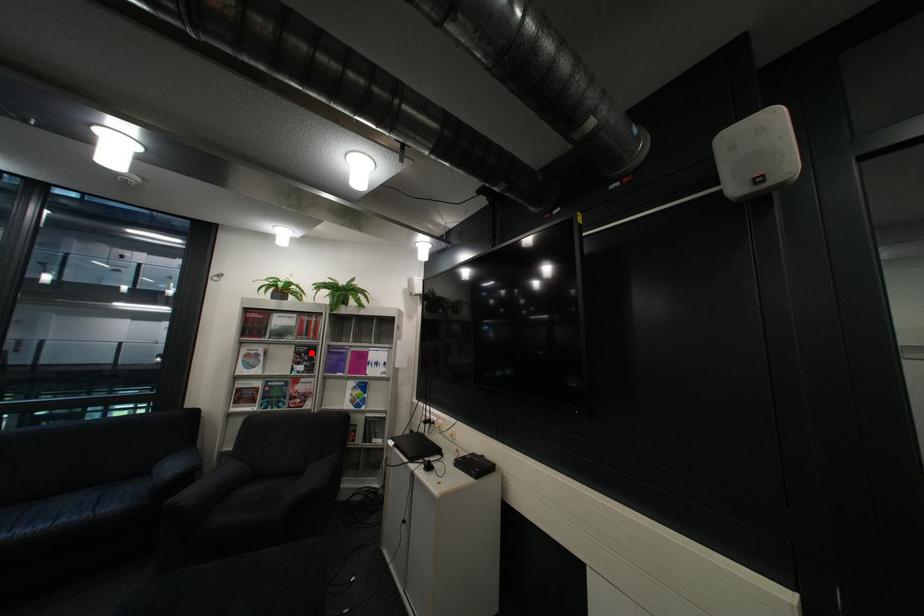
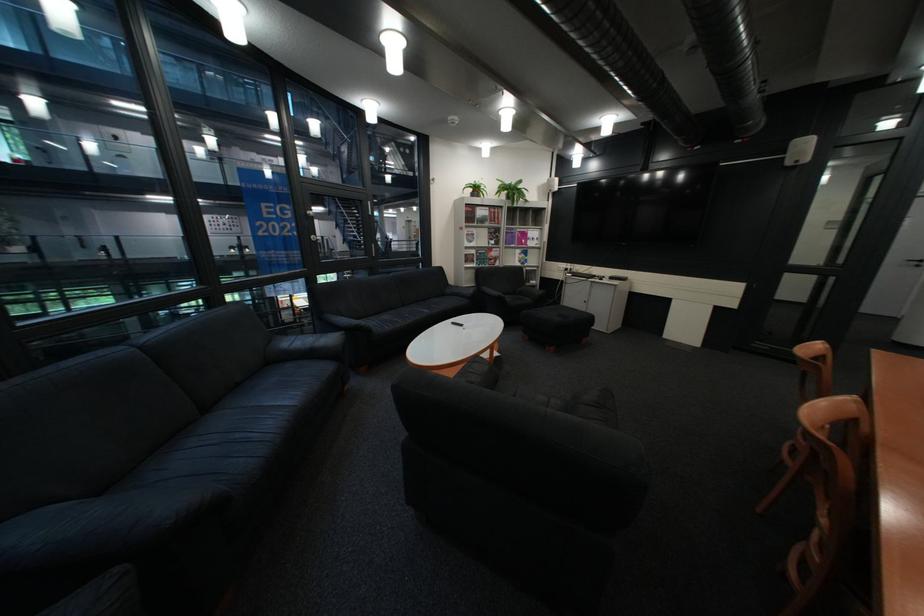
Find the pixel in the second image that matches the highlighted location in the first image.

(505, 233)